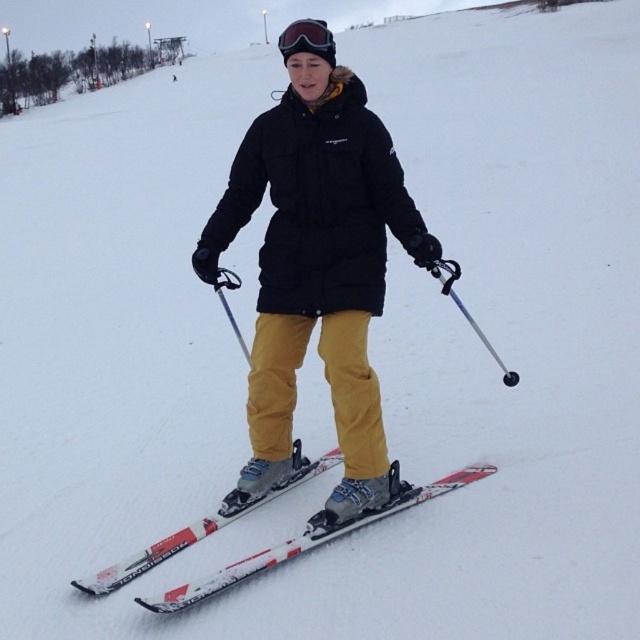
Question: Which of the following is the farthest from the observer?

Choices:
 (A) (316, 38)
 (B) (486, 465)

Answer: (B)

Question: Does white matte skis at center have a smaller size compared to metallic silver ski pole at center?

Choices:
 (A) no
 (B) yes

Answer: (B)

Question: Is matte black jacket at center closer to the viewer compared to glossy ski goggles at center?

Choices:
 (A) yes
 (B) no

Answer: (A)

Question: Which is farther from the matte black jacket at center?

Choices:
 (A) white matte skis at center
 (B) glossy ski goggles at center

Answer: (B)

Question: Where is matte black jacket at center located in relation to glossy ski goggles at center in the image?

Choices:
 (A) right
 (B) left

Answer: (A)

Question: Which point is closer to the camera?

Choices:
 (A) (342, 369)
 (B) (509, 372)
 (C) (150, 604)
 (D) (296, 36)

Answer: (C)